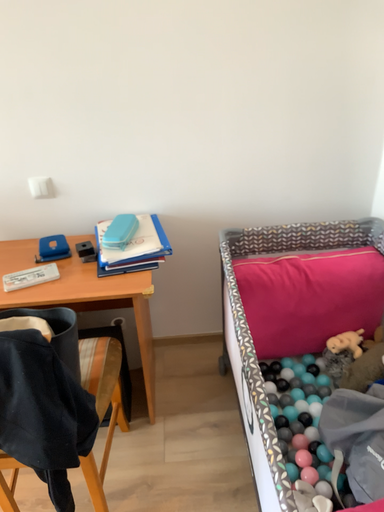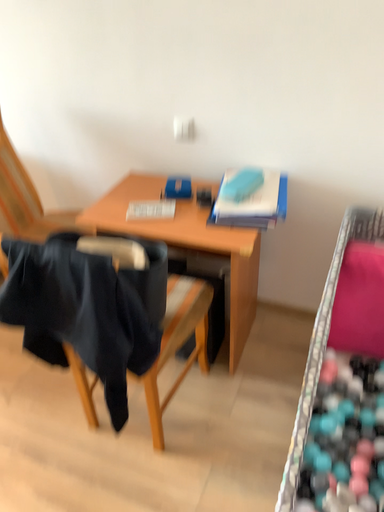
Question: Which way did the camera rotate in the video?

Choices:
 (A) rotated left
 (B) rotated right

Answer: (A)